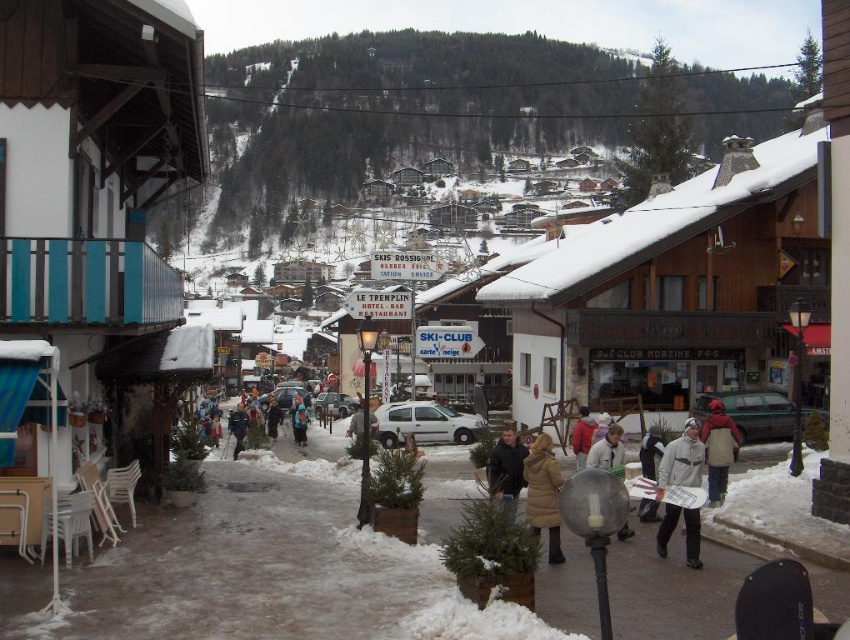
Question: Does red jacket at center have a smaller size compared to blue fabric jacket at center?

Choices:
 (A) no
 (B) yes

Answer: (B)

Question: Is red woolen hat at lower right above light beige jacket at center?

Choices:
 (A) no
 (B) yes

Answer: (B)

Question: Which point appears farthest from the camera in this image?

Choices:
 (A) (620, 460)
 (B) (231, 412)

Answer: (B)

Question: Is brown fuzzy coat at center to the right of blue woolen jacket at center from the viewer's perspective?

Choices:
 (A) no
 (B) yes

Answer: (B)

Question: Which object is closer to the camera taking this photo?

Choices:
 (A) brown fuzzy coat at center
 (B) red woolen hat at lower right

Answer: (A)

Question: Which is nearer to the dark gray jacket at center?

Choices:
 (A) red jacket at center
 (B) red woolen hat at lower right
 (C) gray woolen jacket at center

Answer: (C)